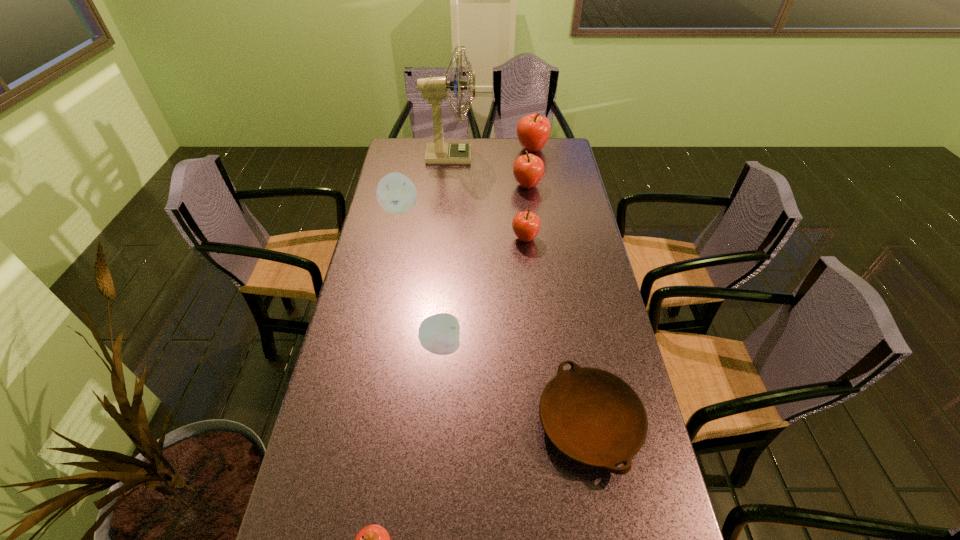
Locate an element on the screen. Image resolution: width=960 pixels, height=540 pixels. free space located 0.190m on the left of the shortest object is located at coordinates (462, 423).

I want to click on fan present at the far edge, so click(x=435, y=89).

At what (x,y) coordinates should I click in order to perform the action: click on apple that is at the far edge. Please return your answer as a coordinate pair (x, y). The image size is (960, 540). Looking at the image, I should click on (533, 131).

Locate an element on the screen. This screenshot has width=960, height=540. fan present at the left edge is located at coordinates (435, 89).

This screenshot has height=540, width=960. In order to click on apple present at the left edge in this screenshot , I will do `click(396, 193)`.

The image size is (960, 540). I want to click on plate at the right edge, so click(592, 416).

I want to click on object that is positioned at the far left corner, so click(435, 89).

Identify the location of object that is at the far right corner. The height and width of the screenshot is (540, 960). (533, 131).

Identify the location of free space at the left edge of the desktop. [x=342, y=368].

This screenshot has width=960, height=540. Find the location of `vacant area between the blue fan and the third biggest pink apple`. vacant area between the blue fan and the third biggest pink apple is located at coordinates (488, 197).